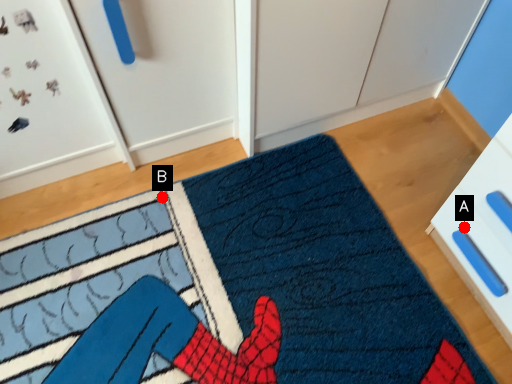
Question: Two points are circled on the image, labeled by A and B beside each circle. Which point is closer to the camera?

Choices:
 (A) A is closer
 (B) B is closer

Answer: (A)